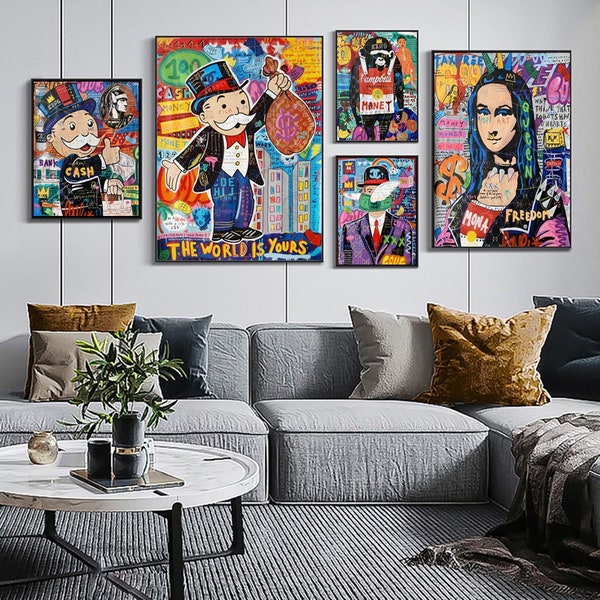
Where is `table`? table is located at coordinates (202, 478).